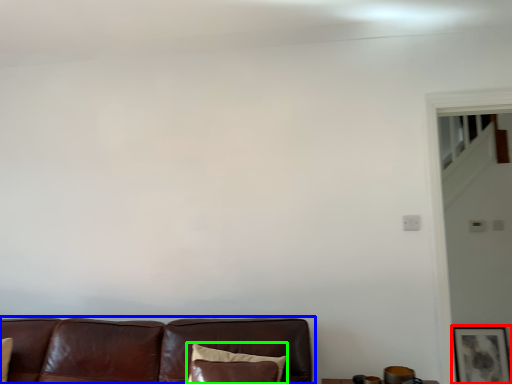
Question: Based on their relative distances, which object is farther from picture frame (highlighted by a red box)? Choose from studio couch (highlighted by a blue box) and pillow (highlighted by a green box).

Choices:
 (A) studio couch
 (B) pillow

Answer: (B)